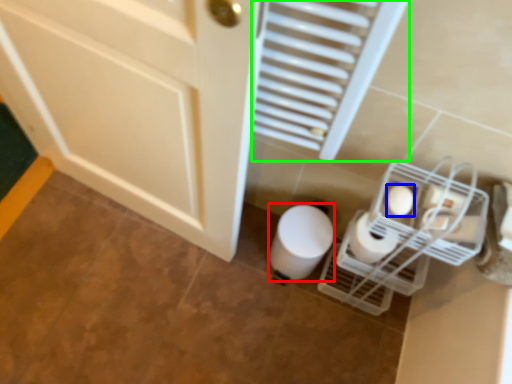
Question: Based on their relative distances, which object is farther from toilet paper (highlighted by a red box)? Choose from toilet paper (highlighted by a blue box) and radiator (highlighted by a green box).

Choices:
 (A) toilet paper
 (B) radiator

Answer: (B)